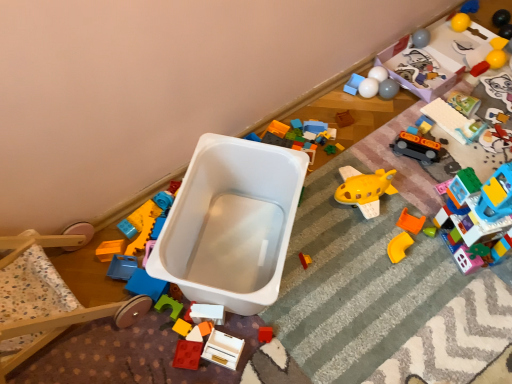
Find the location of `free location in front of white plastic toy at center, which is the third toy from left to right`. free location in front of white plastic toy at center, which is the third toy from left to right is located at coordinates (197, 362).